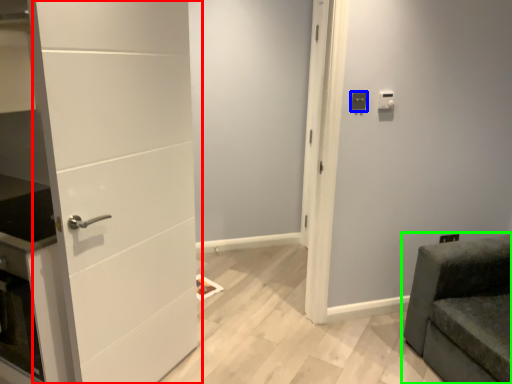
Question: Considering the real-world distances, which object is closest to door (highlighted by a red box)? light switch (highlighted by a blue box) or furniture (highlighted by a green box).

Choices:
 (A) light switch
 (B) furniture

Answer: (A)